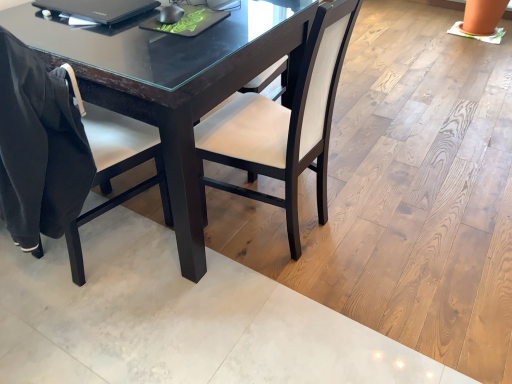
Identify the location of vacant region to the right of satin white chair at center, the 2th chair viewed from the left. (364, 223).